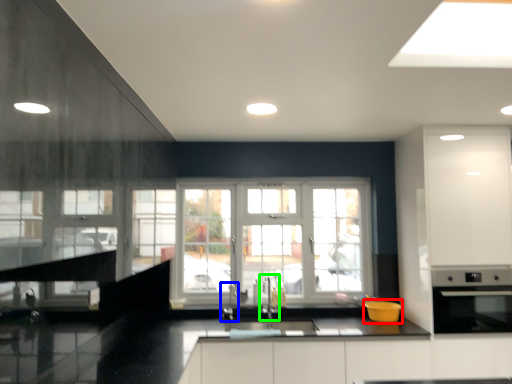
Question: Based on their relative distances, which object is farther from appliance (highlighted by a red box)? Choose from faucet (highlighted by a blue box) and faucet (highlighted by a green box).

Choices:
 (A) faucet
 (B) faucet

Answer: (A)